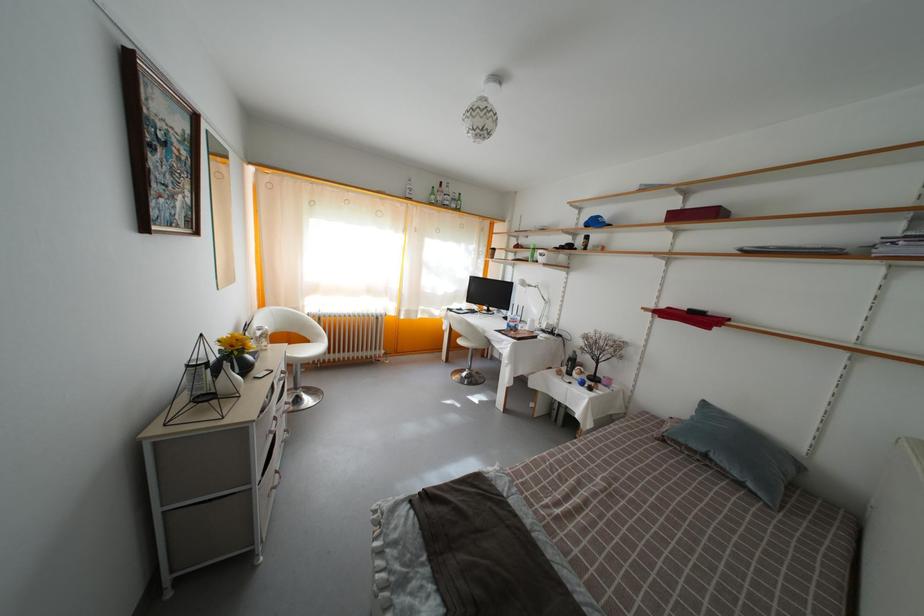
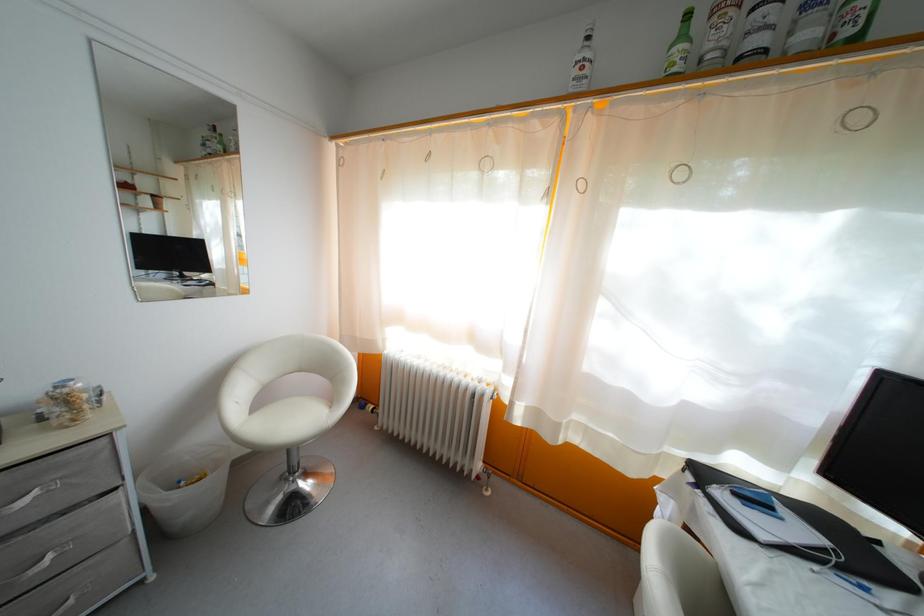
Where in the second image is the point corresponding to (439,200) from the first image?

(688, 43)